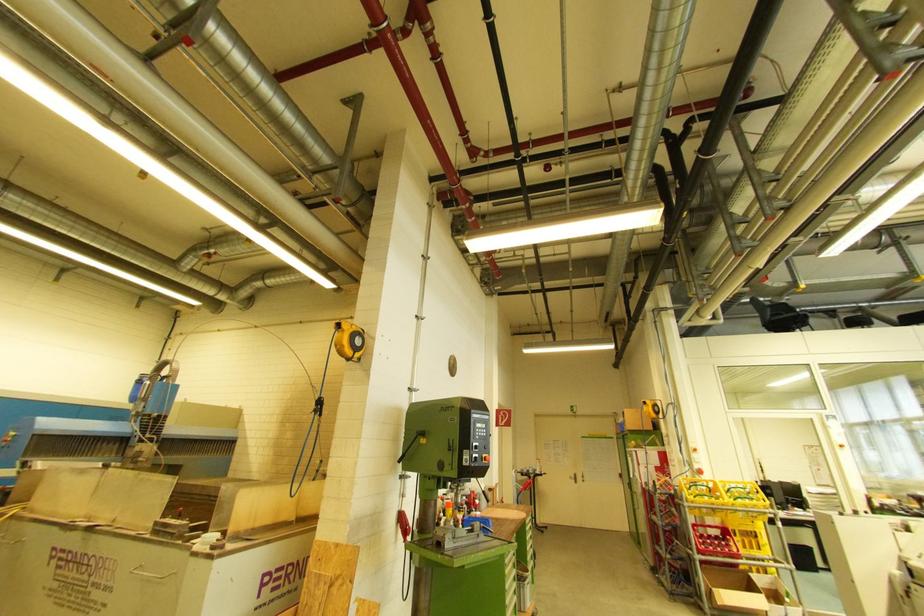
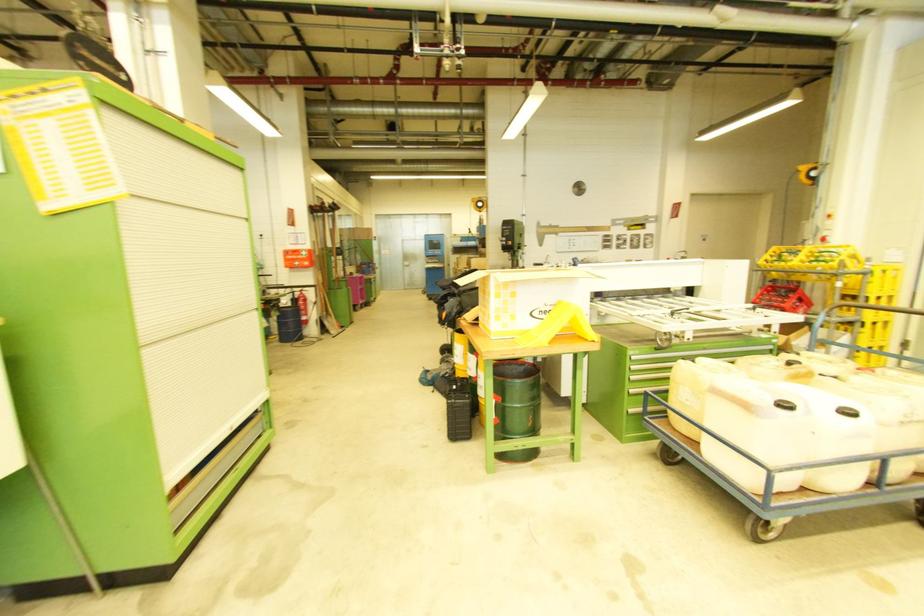
Question: I am providing you with two images of the same scene from different viewpoints. After the viewpoint changes to image2, which objects are now occluded?

Choices:
 (A) first aid kit latch
 (B) red stop button
 (C) yellow balloon
 (D) black case handle

Answer: (B)